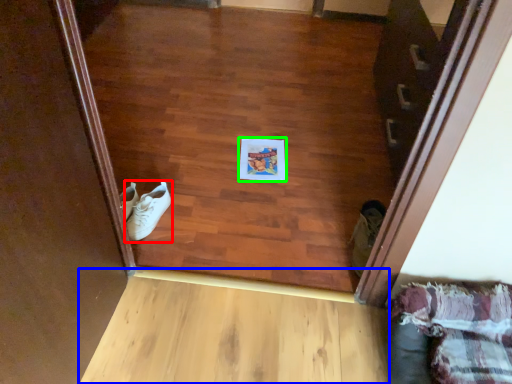
Question: Estimate the real-world distances between objects in this image. Which object is farther from footwear (highlighted by a red box), plank (highlighted by a blue box) or copy (highlighted by a green box)?

Choices:
 (A) plank
 (B) copy

Answer: (A)